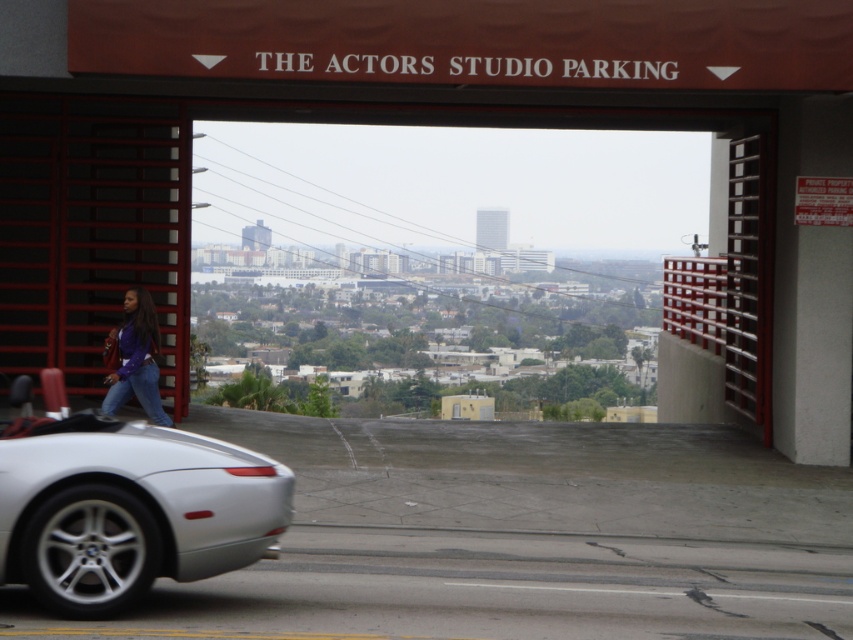
Question: Is silver metallic car at lower left positioned at the back of matte purple shirt at center?

Choices:
 (A) yes
 (B) no

Answer: (B)

Question: Which object appears closest to the camera in this image?

Choices:
 (A) silver metallic car at lower left
 (B) matte purple shirt at center

Answer: (A)

Question: Is silver metallic car at lower left further to the viewer compared to matte purple shirt at center?

Choices:
 (A) yes
 (B) no

Answer: (B)

Question: Can you confirm if silver metallic car at lower left is smaller than matte purple shirt at center?

Choices:
 (A) no
 (B) yes

Answer: (B)